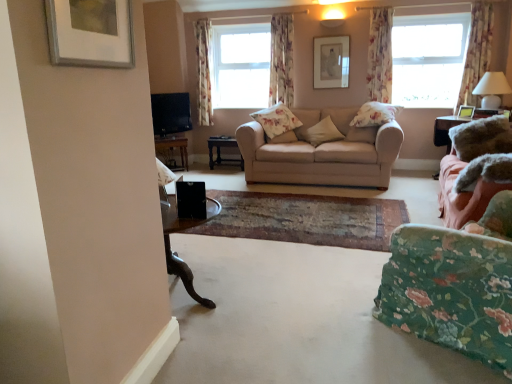
Question: Visually, is white fabric window at upper right positioned to the left or to the right of beige fabric couch at center, the second studio couch viewed from the front?

Choices:
 (A) left
 (B) right

Answer: (B)

Question: Is white fabric window at upper right wider or thinner than beige fabric couch at center, the second studio couch viewed from the front?

Choices:
 (A) thin
 (B) wide

Answer: (A)

Question: Which object is positioned farthest from the beige fabric pillow at center, placed as the 3th pillow when sorted from back to front?

Choices:
 (A) wooden table at center, which ranks as the 2th table in right-to-left order
 (B) floral fabric curtain at upper right, acting as the 3th curtain starting from the left
 (C) floral fabric curtain at upper center, which is the 1th curtain from left to right
 (D) beige fabric couch at center, the second studio couch viewed from the front
 (E) floral fabric chair at lower right

Answer: (E)

Question: Considering the real-world distances, which object is farthest from the beige fabric couch at center, the second studio couch viewed from the front?

Choices:
 (A) floral fabric curtain at upper center, which is the 1th curtain from left to right
 (B) white glossy lampshade at right
 (C) black plastic speaker at center
 (D) floral fabric pillow at center, which appears as the 4th pillow when viewed from the back
 (E) fluffy pink couch at right, the 1th studio couch positioned from the front

Answer: (C)